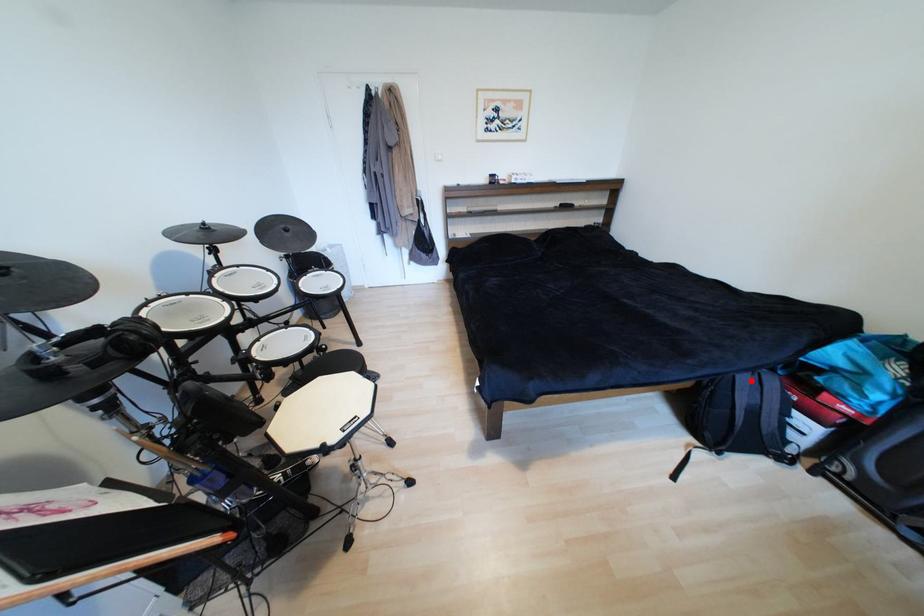
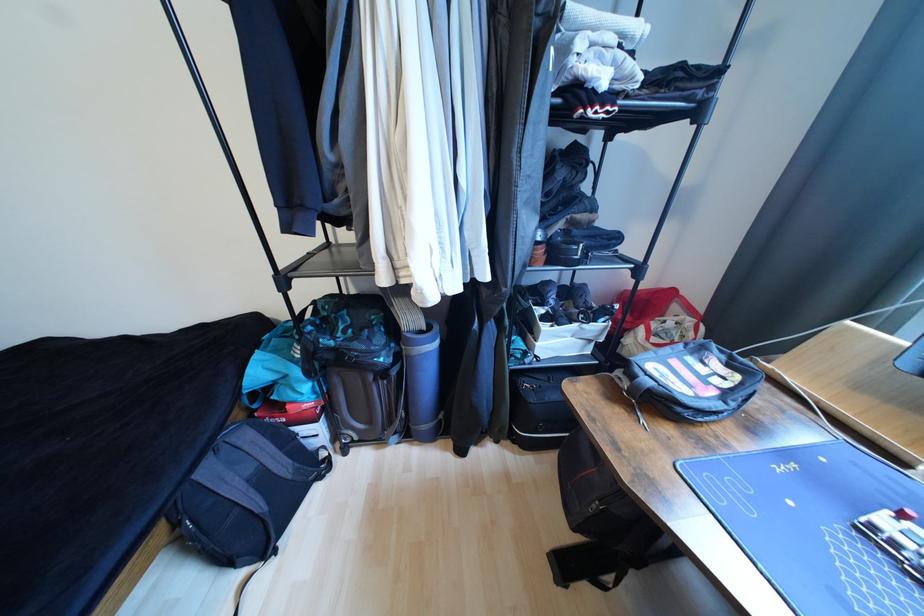
The point at the highlighted location is marked in the first image. Where is the corresponding point in the second image?

(215, 472)